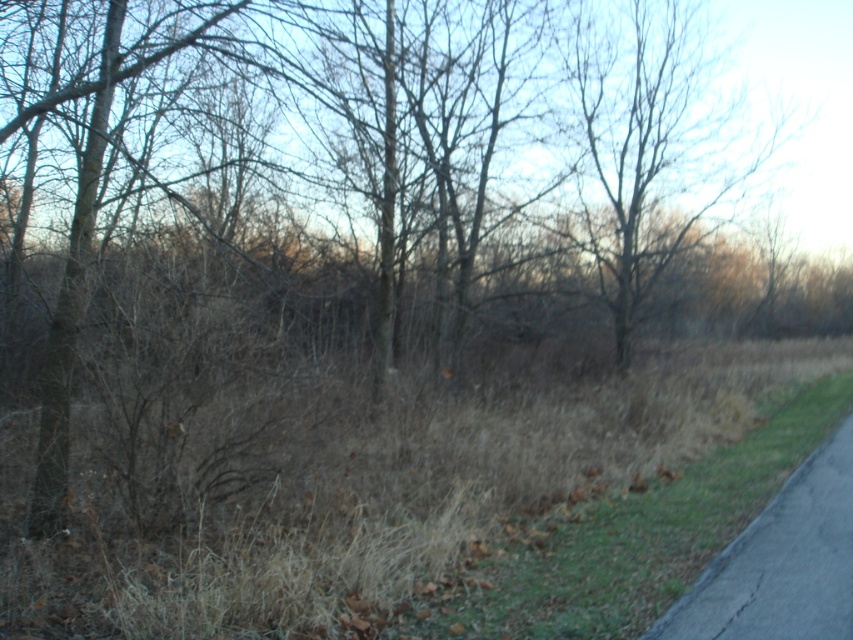
Does brown dry grass at lower right have a lesser width compared to black asphalt bike path at lower right?

No, brown dry grass at lower right is not thinner than black asphalt bike path at lower right.

Can you confirm if brown dry grass at lower right is shorter than black asphalt bike path at lower right?

No, brown dry grass at lower right is not shorter than black asphalt bike path at lower right.

Is point (527, 627) closer to camera compared to point (805, 564)?

Yes, point (527, 627) is closer to viewer.

You are a GUI agent. You are given a task and a screenshot of the screen. Output one action in this format:
    pyautogui.click(x=<x>, y=<y>)
    Task: Click on the brown dry grass at lower right
    The image size is (853, 640).
    Given the screenshot: What is the action you would take?
    [630, 538]

Is brown dry grass at lower left further to the viewer compared to brown dry grass at lower right?

No, it is not.

Who is positioned more to the left, brown dry grass at lower left or brown dry grass at lower right?

From the viewer's perspective, brown dry grass at lower left appears more on the left side.

What do you see at coordinates (381, 502) in the screenshot? The width and height of the screenshot is (853, 640). I see `brown dry grass at lower left` at bounding box center [381, 502].

The image size is (853, 640). What are the coordinates of `brown dry grass at lower left` in the screenshot? It's located at (381, 502).

Is point (399, 438) positioned in front of point (788, 592)?

That is False.

This screenshot has height=640, width=853. I want to click on brown dry grass at lower left, so click(381, 502).